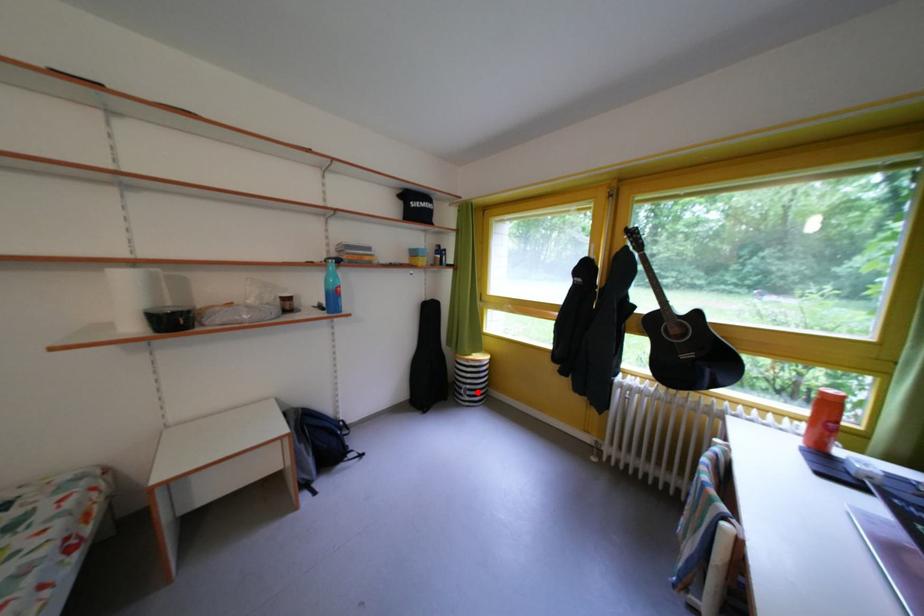
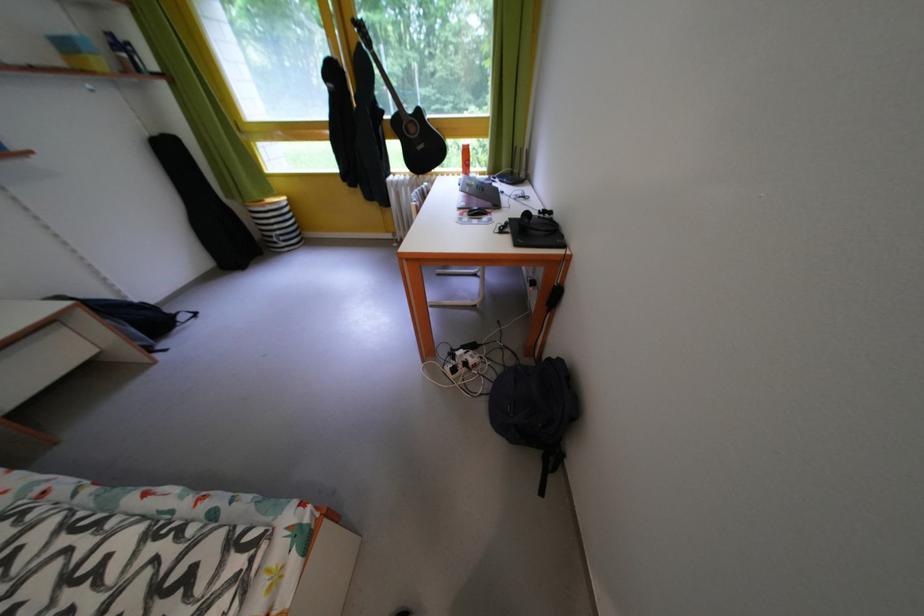
Question: A red point is marked in image1. In image2, is the corresponding 3D point closer to the camera or farther? Reply with the corresponding letter.

Choices:
 (A) The corresponding 3D point is closer.
 (B) The corresponding 3D point is farther.

Answer: (A)